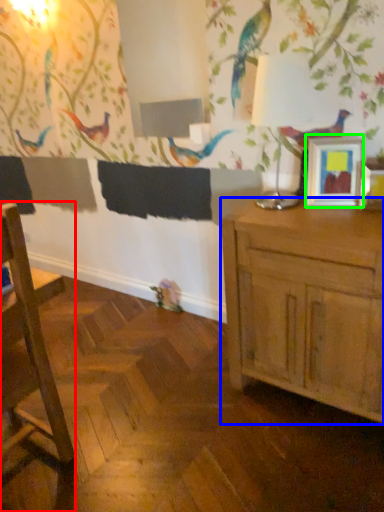
Question: Considering the real-world distances, which object is closest to chair (highlighted by a red box)? cabinetry (highlighted by a blue box) or picture frame (highlighted by a green box).

Choices:
 (A) cabinetry
 (B) picture frame

Answer: (A)